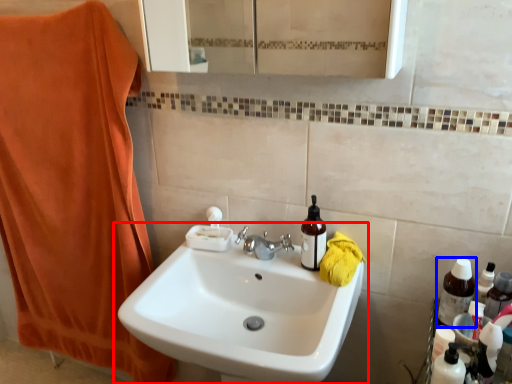
Question: Which object is closer to the camera taking this photo, sink (highlighted by a red box) or bottle (highlighted by a blue box)?

Choices:
 (A) sink
 (B) bottle

Answer: (A)